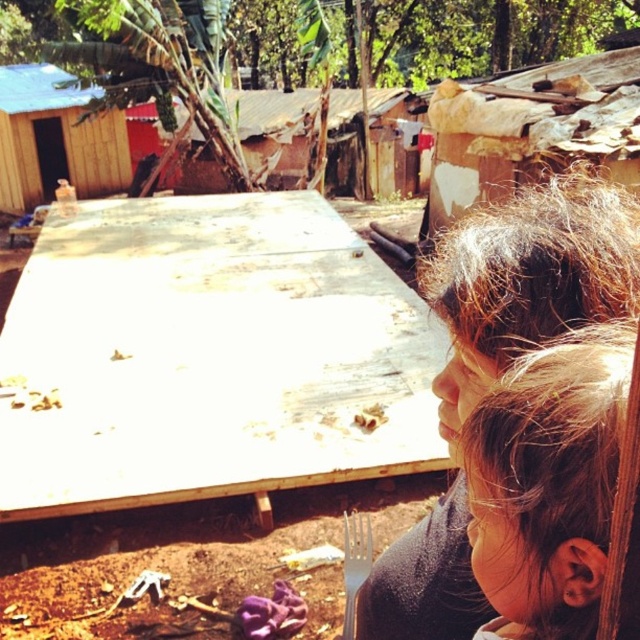
Does rusty corrugated metal hut at upper right appear on the left side of silver metallic fork at lower center?

Incorrect, rusty corrugated metal hut at upper right is not on the left side of silver metallic fork at lower center.

Is point (528, 166) positioned in front of point (355, 554)?

That is False.

Does point (544, 132) lie in front of point (365, 528)?

No.

Identify the location of rusty corrugated metal hut at upper right. The height and width of the screenshot is (640, 640). (531, 131).

This screenshot has width=640, height=640. What are the coordinates of `rusty corrugated metal hut at upper right` in the screenshot? It's located at (531, 131).

Is rusty corrugated metal hut at upper right shorter than rusty corrugated metal hut at center?

No.

Which is behind, point (611, 60) or point (289, 164)?

Point (289, 164)

Image resolution: width=640 pixels, height=640 pixels. What are the coordinates of `rusty corrugated metal hut at upper right` in the screenshot? It's located at (531, 131).

Which is more to the right, rusty corrugated metal hut at center or silver metallic fork at lower center?

silver metallic fork at lower center is more to the right.

Is point (145, 104) positioned behind point (362, 532)?

Yes, it is behind point (362, 532).

Which is in front, point (387, 104) or point (365, 561)?

Point (365, 561) is more forward.

Find the location of `rusty corrugated metal hut at center`. rusty corrugated metal hut at center is located at coordinates (275, 125).